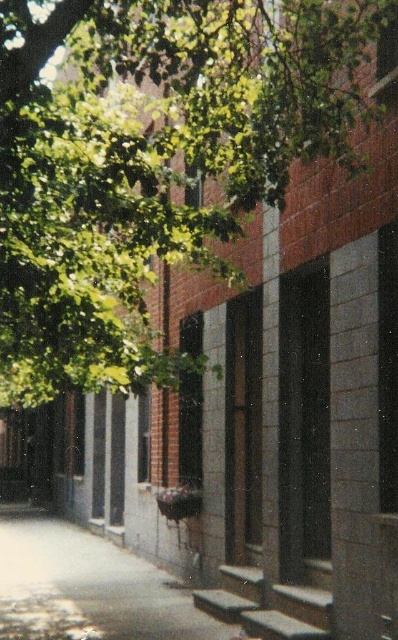
Question: Considering the relative positions of green leafy tree at upper left and gray concrete pavement at lower center in the image provided, where is green leafy tree at upper left located with respect to gray concrete pavement at lower center?

Choices:
 (A) right
 (B) left

Answer: (A)

Question: Is green leafy tree at upper left to the right of gray concrete pavement at lower center from the viewer's perspective?

Choices:
 (A) no
 (B) yes

Answer: (B)

Question: Does green leafy tree at upper left have a smaller size compared to gray concrete pavement at lower center?

Choices:
 (A) yes
 (B) no

Answer: (A)

Question: Which of the following is the farthest from the observer?

Choices:
 (A) (13, 64)
 (B) (142, 564)

Answer: (B)

Question: Among these points, which one is nearest to the camera?

Choices:
 (A) (122, 228)
 (B) (64, 592)

Answer: (A)

Question: Among these objects, which one is nearest to the camera?

Choices:
 (A) green leafy tree at upper left
 (B) gray concrete pavement at lower center

Answer: (A)